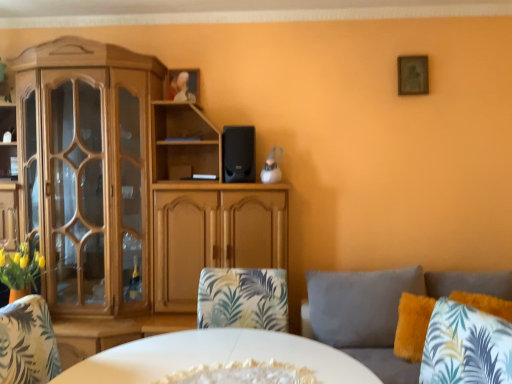
What do you see at coordinates (413, 75) in the screenshot?
I see `wooden picture frame at upper right` at bounding box center [413, 75].

What do you see at coordinates (128, 195) in the screenshot? Image resolution: width=512 pixels, height=384 pixels. I see `wooden cabinet at left` at bounding box center [128, 195].

Describe the element at coordinates (214, 357) in the screenshot. I see `white glossy plate at center` at that location.

The height and width of the screenshot is (384, 512). I want to click on wooden picture frame at upper right, so click(413, 75).

From a real-world perspective, which object rests below the other?

In real-world perspective, wooden cabinet at left is lower.

Is point (232, 145) positioned in front of point (177, 223)?

Yes, point (232, 145) is closer to viewer.

From the image's perspective, between black matte speaker at center and wooden cabinet at left, which one is located above?

black matte speaker at center appears higher in the image.

Could you tell me if black matte speaker at center is turned towards wooden cabinet at left?

Yes.

From a real-world perspective, who is located higher, fluffy gray couch at right or white glossy plate at center?

In real-world perspective, white glossy plate at center is above.

Is fluffy gray couch at right taller than white glossy plate at center?

Indeed, fluffy gray couch at right has a greater height compared to white glossy plate at center.

From the picture: How different are the orientations of fluffy gray couch at right and white glossy plate at center in degrees?

The angular difference between fluffy gray couch at right and white glossy plate at center is 26.7 degrees.

From the image's perspective, between fluffy gray couch at right and white glossy plate at center, which one is located above?

white glossy plate at center is shown above in the image.

The width and height of the screenshot is (512, 384). What are the coordinates of `desk below the black matte speaker at center (from the image's perspective)` in the screenshot? It's located at (214, 357).

Which is nearer, (236, 155) or (215, 349)?

Clearly, point (236, 155) is more distant from the camera than point (215, 349).

Who is shorter, black matte speaker at center or white glossy plate at center?

With less height is white glossy plate at center.

Relative to white glossy plate at center, is black matte speaker at center in front or behind?

Visually, black matte speaker at center is located behind white glossy plate at center.

Would you say wooden cabinet at left is to the left or to the right of black matte speaker at center in the picture?

In the image, wooden cabinet at left appears on the left side of black matte speaker at center.

Does wooden cabinet at left have a larger size compared to black matte speaker at center?

Indeed, wooden cabinet at left has a larger size compared to black matte speaker at center.

Can you tell me how much wooden cabinet at left and black matte speaker at center differ in facing direction?

There is a 0.000893-degree angle between the facing directions of wooden cabinet at left and black matte speaker at center.

How much distance is there between wooden cabinet at left and black matte speaker at center?

wooden cabinet at left and black matte speaker at center are 27.20 inches apart from each other.

Is fluffy gray couch at right a part of black matte speaker at center?

No, fluffy gray couch at right is not a part of black matte speaker at center.

Does black matte speaker at center touch fluffy gray couch at right?

No, black matte speaker at center is not making contact with fluffy gray couch at right.

Which is behind, point (239, 134) or point (332, 345)?

The point (239, 134) is farther from the camera.

From the image's perspective, is black matte speaker at center on top of fluffy gray couch at right?

Yes.

Is wooden picture frame at upper right completely or partially inside white glossy plate at center?

Actually, wooden picture frame at upper right is outside white glossy plate at center.

Based on the photo, does white glossy plate at center appear on the right side of wooden picture frame at upper right?

No, white glossy plate at center is not to the right of wooden picture frame at upper right.

Locate an element on the screen. This screenshot has height=384, width=512. desk below the wooden picture frame at upper right (from a real-world perspective) is located at coordinates (214, 357).

Based on the photo, is white glossy plate at center wider or thinner than wooden picture frame at upper right?

white glossy plate at center is wider than wooden picture frame at upper right.

Which is in front, point (477, 304) or point (399, 78)?

The point (477, 304) is closer.

Considering the sizes of objects fluffy yellow pillow at lower right and wooden picture frame at upper right in the image provided, who is wider, fluffy yellow pillow at lower right or wooden picture frame at upper right?

Wider between the two is fluffy yellow pillow at lower right.

From a real-world perspective, between fluffy yellow pillow at lower right and wooden picture frame at upper right, who is vertically lower?

fluffy yellow pillow at lower right is physically lower.

Locate an element on the screen. This screenshot has width=512, height=384. cabinetry in front of the black matte speaker at center is located at coordinates (128, 195).

Locate an element on the screen. The height and width of the screenshot is (384, 512). desk above the fluffy gray couch at right (from a real-world perspective) is located at coordinates (214, 357).

Looking at the image, which one is located closer to black matte speaker at center, wooden picture frame at upper right or white glossy plate at center?

wooden picture frame at upper right lies closer to black matte speaker at center than the other object.

Looking at the image, which one is located closer to fluffy yellow pillow at lower right, white glossy plate at center or fluffy gray couch at right?

Among the two, fluffy gray couch at right is located nearer to fluffy yellow pillow at lower right.

Estimate the real-world distances between objects in this image. Which object is closer to wooden picture frame at upper right, fluffy gray couch at right or white glossy plate at center?

fluffy gray couch at right.

Considering their positions, is black matte speaker at center positioned further to fluffy gray couch at right than wooden picture frame at upper right?

Among the two, wooden picture frame at upper right is located further to fluffy gray couch at right.

Which object lies nearer to the anchor point fluffy gray couch at right, wooden cabinet at left or wooden picture frame at upper right?

The object closer to fluffy gray couch at right is wooden cabinet at left.

From the image, which object appears to be farther from black matte speaker at center, fluffy yellow pillow at lower right or fluffy gray couch at right?

fluffy yellow pillow at lower right is positioned further to the anchor black matte speaker at center.

Estimate the real-world distances between objects in this image. Which object is further from white glossy plate at center, fluffy gray couch at right or wooden cabinet at left?

The object further to white glossy plate at center is wooden cabinet at left.

From the image, which object appears to be nearer to wooden picture frame at upper right, wooden cabinet at left or fluffy gray couch at right?

Based on the image, fluffy gray couch at right appears to be nearer to wooden picture frame at upper right.

At what (x,y) coordinates should I click in order to perform the action: click on studio couch located between white glossy plate at center and fluffy yellow pillow at lower right in the left-right direction. Please return your answer as a coordinate pair (x, y). The image size is (512, 384). Looking at the image, I should click on (381, 310).

Identify the location of speaker located between wooden cabinet at left and fluffy yellow pillow at lower right in the left-right direction. (238, 154).

Find the location of a particular element. This screenshot has width=512, height=384. picture frame located between wooden cabinet at left and fluffy yellow pillow at lower right in the left-right direction is located at coordinates (413, 75).

Locate an element on the screen. The height and width of the screenshot is (384, 512). studio couch between wooden cabinet at left and fluffy yellow pillow at lower right is located at coordinates (381, 310).